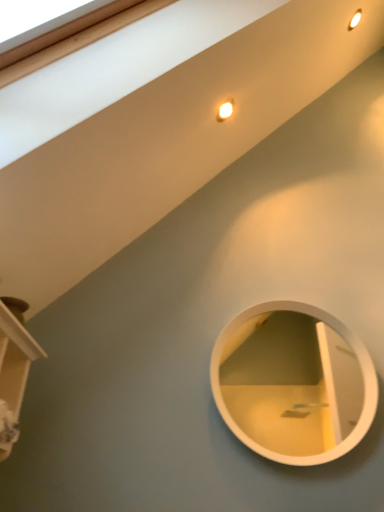
Find the location of a particular element. The height and width of the screenshot is (512, 384). white glossy mirror at center is located at coordinates (293, 384).

What do you see at coordinates (293, 384) in the screenshot? I see `white glossy mirror at center` at bounding box center [293, 384].

Consider the image. Measure the distance between point [10,383] and camera.

1.12 meters.

The image size is (384, 512). Describe the element at coordinates (13, 370) in the screenshot. I see `wooden shelf at lower left` at that location.

This screenshot has height=512, width=384. In order to click on wooden shelf at lower left in this screenshot , I will do `click(13, 370)`.

The image size is (384, 512). I want to click on white glossy mirror at center, so click(293, 384).

Is wooden shelf at lower left to the right of white glossy mirror at center from the viewer's perspective?

No.

Who is more distant, wooden shelf at lower left or white glossy mirror at center?

white glossy mirror at center is further away from the camera.

Is point (7, 324) farther from viewer compared to point (244, 366)?

No, (7, 324) is in front of (244, 366).

From the image's perspective, is wooden shelf at lower left on white glossy mirror at center?

Yes, from the image's perspective, wooden shelf at lower left is on top of white glossy mirror at center.

From a real-world perspective, which object stands above the other?

white glossy mirror at center is physically above.

Which of these two, wooden shelf at lower left or white glossy mirror at center, is thinner?

Thinner between the two is white glossy mirror at center.

Does wooden shelf at lower left have a lesser height compared to white glossy mirror at center?

Yes, wooden shelf at lower left is shorter than white glossy mirror at center.

Considering the relative sizes of wooden shelf at lower left and white glossy mirror at center in the image provided, is wooden shelf at lower left bigger than white glossy mirror at center?

Yes.

Is white glossy mirror at center inside wooden shelf at lower left?

No, white glossy mirror at center is located outside of wooden shelf at lower left.

Is wooden shelf at lower left beside white glossy mirror at center?

No, wooden shelf at lower left is not next to white glossy mirror at center.

Is wooden shelf at lower left oriented away from white glossy mirror at center?

wooden shelf at lower left is not turned away from white glossy mirror at center.

Where is `mirror on the right of wooden shelf at lower left`? mirror on the right of wooden shelf at lower left is located at coordinates (293, 384).

Which object is positioned more to the right, white glossy mirror at center or wooden shelf at lower left?

white glossy mirror at center.

Between white glossy mirror at center and wooden shelf at lower left, which one is positioned in front?

wooden shelf at lower left.

Is point (318, 359) less distant than point (18, 413)?

No, it is not.

From the image's perspective, which is above, white glossy mirror at center or wooden shelf at lower left?

wooden shelf at lower left, from the image's perspective.

From a real-world perspective, is white glossy mirror at center above or below wooden shelf at lower left?

white glossy mirror at center is above wooden shelf at lower left.

Is white glossy mirror at center wider than wooden shelf at lower left?

Incorrect, the width of white glossy mirror at center does not surpass that of wooden shelf at lower left.

Based on the photo, can you confirm if white glossy mirror at center is shorter than wooden shelf at lower left?

No, white glossy mirror at center is not shorter than wooden shelf at lower left.

Between white glossy mirror at center and wooden shelf at lower left, which one has larger size?

Bigger between the two is wooden shelf at lower left.

Choose the correct answer: Is white glossy mirror at center inside wooden shelf at lower left or outside it?

white glossy mirror at center lies outside wooden shelf at lower left.

Is white glossy mirror at center not near wooden shelf at lower left?

Yes, white glossy mirror at center is far from wooden shelf at lower left.

Is white glossy mirror at center turned away from wooden shelf at lower left?

white glossy mirror at center does not have its back to wooden shelf at lower left.

You are a GUI agent. You are given a task and a screenshot of the screen. Output one action in this format:
    pyautogui.click(x=<x>, y=<y>)
    Task: Click on the shelf in front of the white glossy mirror at center
    The width and height of the screenshot is (384, 512).
    Given the screenshot: What is the action you would take?
    pyautogui.click(x=13, y=370)

At what (x,y) coordinates should I click in order to perform the action: click on mirror above the wooden shelf at lower left (from a real-world perspective). Please return your answer as a coordinate pair (x, y). Looking at the image, I should click on (293, 384).

Where is `mirror on the right of wooden shelf at lower left`? Image resolution: width=384 pixels, height=512 pixels. mirror on the right of wooden shelf at lower left is located at coordinates (293, 384).